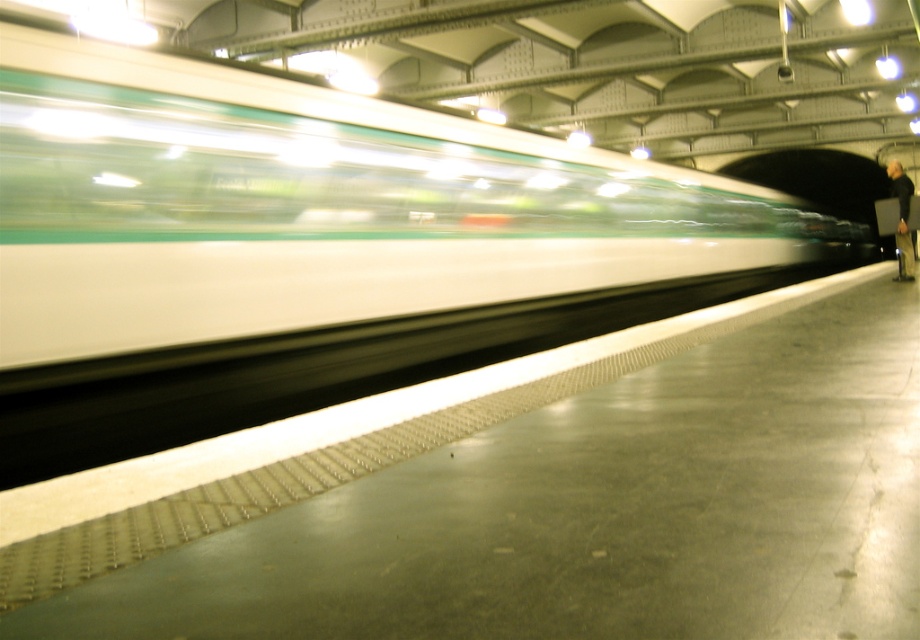
In the scene shown: Is white glossy train at center to the right of dark gray jacket at right from the viewer's perspective?

No, white glossy train at center is not to the right of dark gray jacket at right.

Is white glossy train at center wider than dark gray jacket at right?

Incorrect, white glossy train at center's width does not surpass dark gray jacket at right's.

Who is more forward, (x=173, y=97) or (x=913, y=253)?

Positioned in front is point (x=173, y=97).

Find the location of a particular element. This screenshot has width=920, height=640. white glossy train at center is located at coordinates (314, 246).